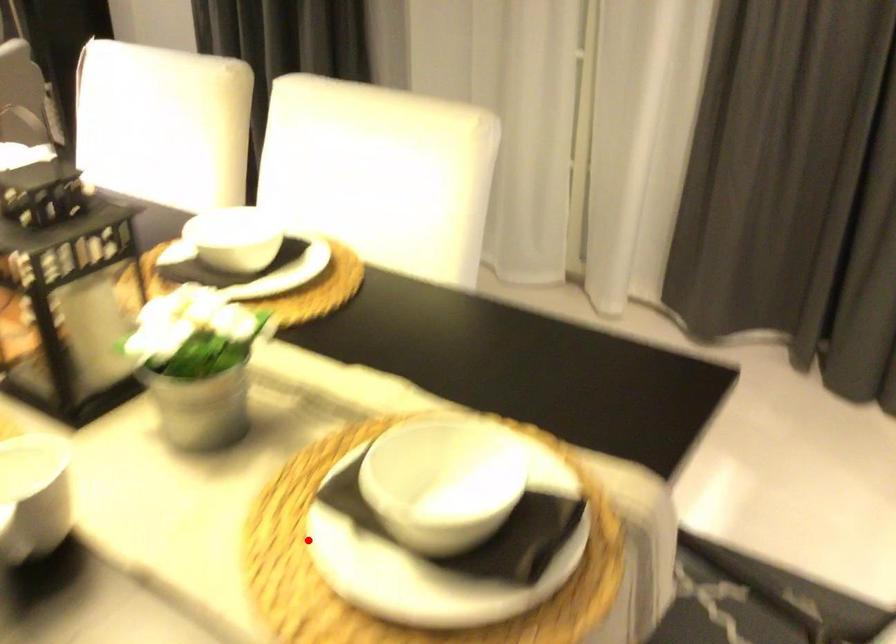
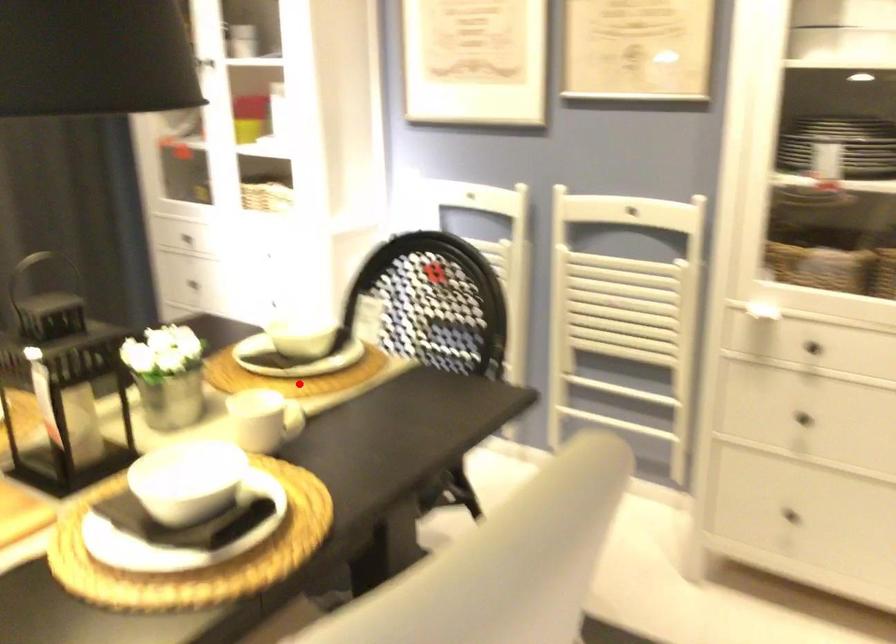
I am providing you with two images of the same scene from different viewpoints. A red point is marked on the first image and another point is marked on the second image. Are the points marked in image1 and image2 representing the same 3D position?

Yes